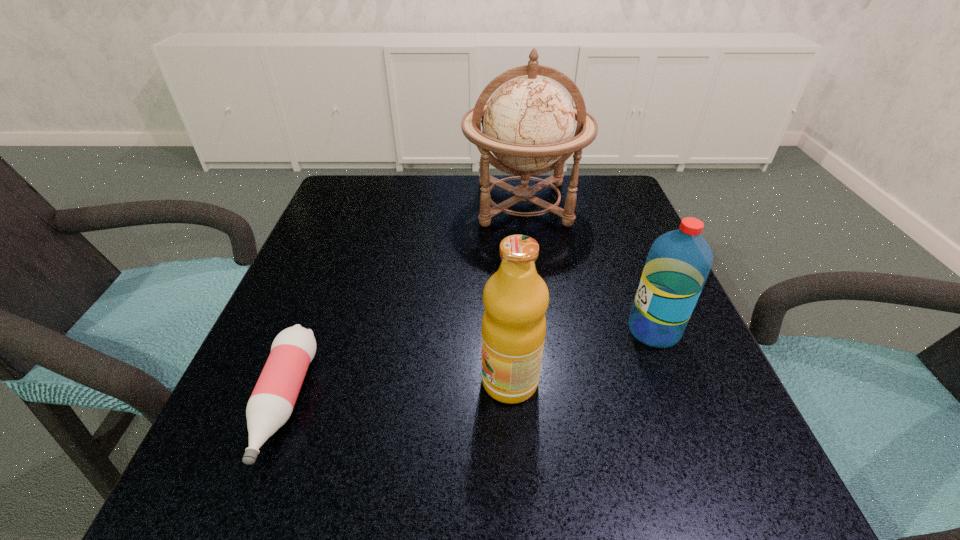
You are a GUI agent. You are given a task and a screenshot of the screen. Output one action in this format:
    pyautogui.click(x=<x>, y=<y>)
    Task: Click on the free space in the image that satisfies the following two spatial constraints: 1. on the front label of the water bottle; 2. with the cap open on the leftmost object
    
    Given the screenshot: What is the action you would take?
    pyautogui.click(x=683, y=402)

This screenshot has height=540, width=960. Identify the location of free space that satisfies the following two spatial constraints: 1. on the front-facing side of the tallest object; 2. on the front label of the second tallest object. (548, 381).

Find the location of a particular element. This screenshot has height=540, width=960. free spot that satisfies the following two spatial constraints: 1. on the front label of the third shortest object; 2. with the cap open on the bottle is located at coordinates (511, 402).

Where is `vacant region that satisfies the following two spatial constraints: 1. on the front label of the rightmost object; 2. with the cap open on the leftmost object`? The height and width of the screenshot is (540, 960). vacant region that satisfies the following two spatial constraints: 1. on the front label of the rightmost object; 2. with the cap open on the leftmost object is located at coordinates (683, 402).

You are a GUI agent. You are given a task and a screenshot of the screen. Output one action in this format:
    pyautogui.click(x=<x>, y=<y>)
    Task: Click on the free region that satisfies the following two spatial constraints: 1. on the front-facing side of the tallest object; 2. on the front label of the fruit juice
    The height and width of the screenshot is (540, 960).
    Given the screenshot: What is the action you would take?
    tap(548, 381)

At what (x,y) coordinates should I click in order to perform the action: click on vacant position in the image that satisfies the following two spatial constraints: 1. on the front label of the second shortest object; 2. with the cap open on the leftmost object. Please return your answer as a coordinate pair (x, y). Looking at the image, I should click on (683, 402).